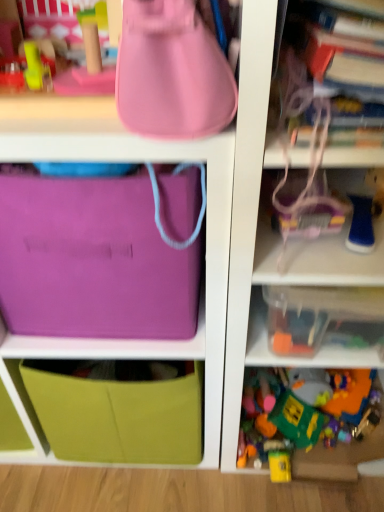
Question: Is there a large distance between matte pink handbag at upper center and translucent plastic container at lower right, the second toy when ordered from top to bottom?

Choices:
 (A) no
 (B) yes

Answer: (A)

Question: Is matte pink handbag at upper center taller than translucent plastic container at lower right, the second toy when ordered from top to bottom?

Choices:
 (A) yes
 (B) no

Answer: (A)

Question: Could translucent plastic container at lower right, marked as the 1th toy in a back-to-front arrangement, be considered to be inside matte pink handbag at upper center?

Choices:
 (A) no
 (B) yes

Answer: (A)

Question: Does matte pink handbag at upper center come in front of translucent plastic container at lower right, marked as the 1th toy in a back-to-front arrangement?

Choices:
 (A) yes
 (B) no

Answer: (A)

Question: Is matte pink handbag at upper center to the left of translucent plastic container at lower right, marked as the first toy in a bottom-to-top arrangement, from the viewer's perspective?

Choices:
 (A) yes
 (B) no

Answer: (A)

Question: From the image's perspective, relative to blue rubber toy at right, acting as the 2th toy starting from the bottom, is translucent plastic container at center right, which is the 1th shelf from top to bottom, above or below?

Choices:
 (A) above
 (B) below

Answer: (B)

Question: Is point (241, 167) positioned closer to the camera than point (354, 196)?

Choices:
 (A) farther
 (B) closer

Answer: (B)

Question: In the image, is translucent plastic container at center right, which is the 1th shelf from top to bottom, positioned in front of or behind blue rubber toy at right, acting as the second toy starting from the back?

Choices:
 (A) front
 (B) behind

Answer: (A)

Question: Looking at their shapes, would you say translucent plastic container at center right, which is the 1th shelf from top to bottom, is wider or thinner than blue rubber toy at right, the first toy positioned from the front?

Choices:
 (A) wide
 (B) thin

Answer: (A)

Question: Relative to translucent plastic container at center right, arranged as the 2th shelf when ordered from the bottom, is purple fabric bag at upper left in front or behind?

Choices:
 (A) front
 (B) behind

Answer: (B)

Question: Is purple fabric bag at upper left taller or shorter than translucent plastic container at center right, arranged as the 2th shelf when ordered from the bottom?

Choices:
 (A) short
 (B) tall

Answer: (A)

Question: From the image's perspective, is purple fabric bag at upper left above or below translucent plastic container at center right, arranged as the 2th shelf when ordered from the bottom?

Choices:
 (A) above
 (B) below

Answer: (B)

Question: From a real-world perspective, relative to translucent plastic container at center right, arranged as the 2th shelf when ordered from the bottom, is purple fabric bag at upper left vertically above or below?

Choices:
 (A) above
 (B) below

Answer: (B)

Question: Based on their positions, is purple fabric bag at upper left located to the left or right of matte pink handbag at upper center?

Choices:
 (A) right
 (B) left

Answer: (B)

Question: In terms of height, does purple fabric bag at upper left look taller or shorter compared to matte pink handbag at upper center?

Choices:
 (A) short
 (B) tall

Answer: (B)